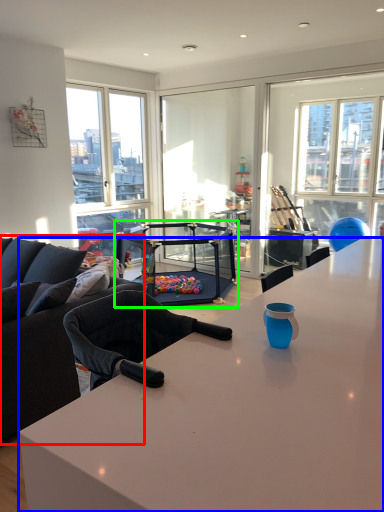
Question: Estimate the real-world distances between objects in this image. Which object is farther from studio couch (highlighted by a red box), desk (highlighted by a blue box) or equipment (highlighted by a green box)?

Choices:
 (A) desk
 (B) equipment

Answer: (B)